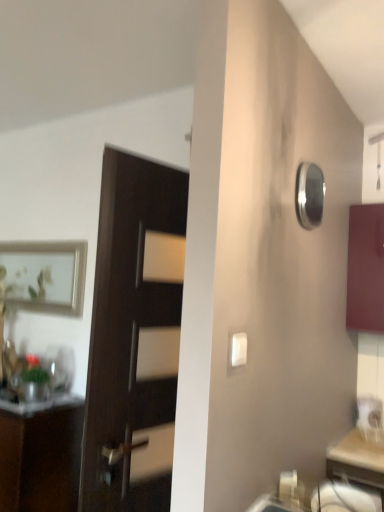
Question: Considering the relative sizes of matte white drawer at lower right and matte silver picture frame at upper left in the image provided, is matte white drawer at lower right smaller than matte silver picture frame at upper left?

Choices:
 (A) yes
 (B) no

Answer: (A)

Question: Does matte white drawer at lower right have a greater width compared to matte silver picture frame at upper left?

Choices:
 (A) no
 (B) yes

Answer: (B)

Question: Can we say matte white drawer at lower right lies outside matte silver picture frame at upper left?

Choices:
 (A) yes
 (B) no

Answer: (A)

Question: Is matte silver picture frame at upper left located within matte white drawer at lower right?

Choices:
 (A) no
 (B) yes

Answer: (A)

Question: Considering the relative sizes of matte white drawer at lower right and matte silver picture frame at upper left in the image provided, is matte white drawer at lower right thinner than matte silver picture frame at upper left?

Choices:
 (A) no
 (B) yes

Answer: (A)

Question: Can you confirm if matte white drawer at lower right is positioned to the left of matte silver picture frame at upper left?

Choices:
 (A) no
 (B) yes

Answer: (A)

Question: Considering the relative sizes of white plastic light switch at center and matte brown cabinet at left, which is the second cabinetry in right-to-left order, in the image provided, is white plastic light switch at center bigger than matte brown cabinet at left, which is the second cabinetry in right-to-left order,?

Choices:
 (A) yes
 (B) no

Answer: (B)

Question: From the image's perspective, does white plastic light switch at center appear lower than matte brown cabinet at left, which is the second cabinetry in right-to-left order?

Choices:
 (A) no
 (B) yes

Answer: (A)

Question: Are white plastic light switch at center and matte brown cabinet at left, positioned as the 1th cabinetry in bottom-to-top order, beside each other?

Choices:
 (A) no
 (B) yes

Answer: (A)

Question: Considering the relative sizes of white plastic light switch at center and matte brown cabinet at left, the first cabinetry from the left, in the image provided, is white plastic light switch at center smaller than matte brown cabinet at left, the first cabinetry from the left,?

Choices:
 (A) no
 (B) yes

Answer: (B)

Question: From a real-world perspective, is white plastic light switch at center on matte brown cabinet at left, the first cabinetry from the left?

Choices:
 (A) no
 (B) yes

Answer: (B)

Question: Is there a large distance between white plastic light switch at center and matte brown cabinet at left, which is the second cabinetry in right-to-left order?

Choices:
 (A) no
 (B) yes

Answer: (B)

Question: Is white plastic light switch at center further to camera compared to matte burgundy cabinet at right, marked as the first cabinetry in a right-to-left arrangement?

Choices:
 (A) yes
 (B) no

Answer: (B)